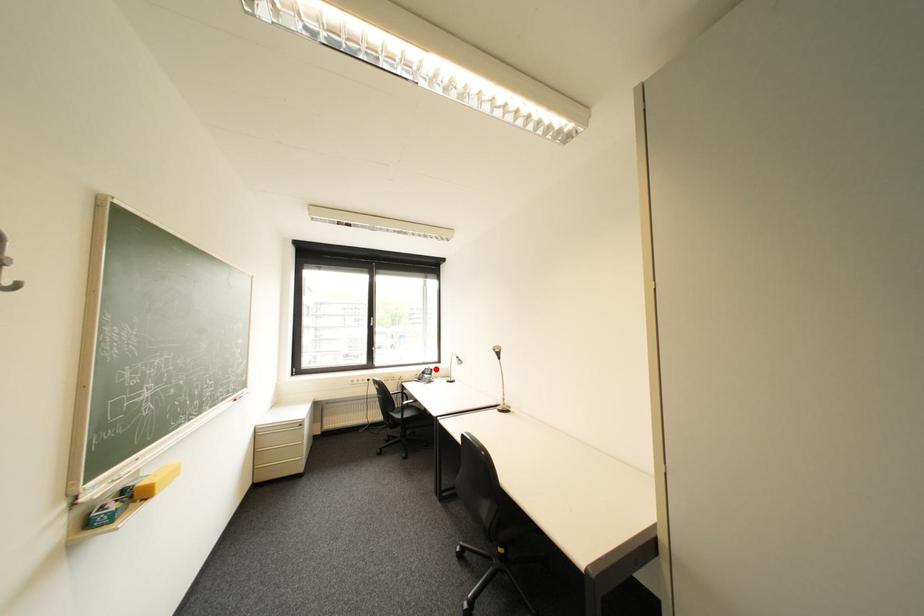
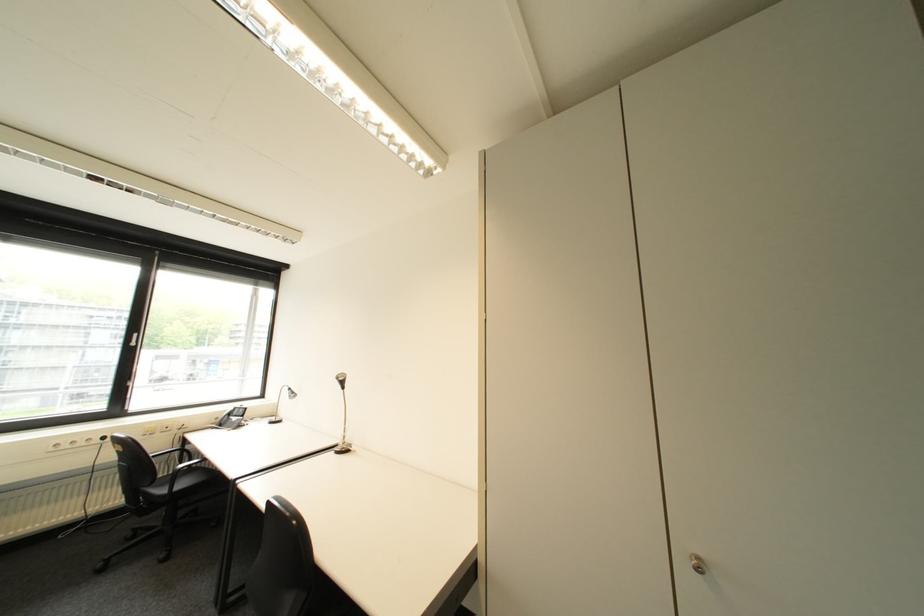
Find the pixel in the second image that matches the highlighted location in the first image.

(246, 408)